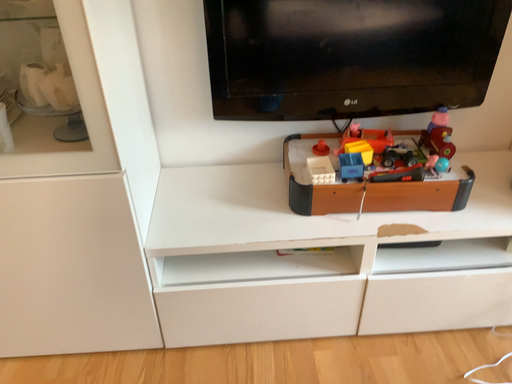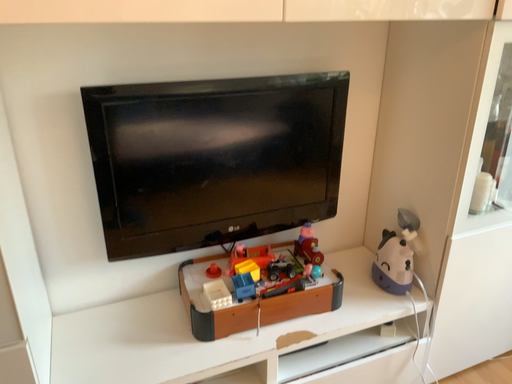
Question: Which way did the camera rotate in the video?

Choices:
 (A) rotated right
 (B) rotated left

Answer: (A)